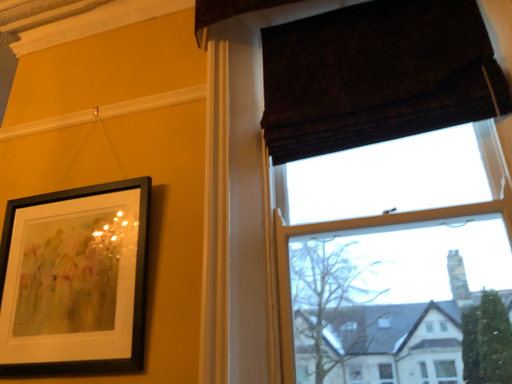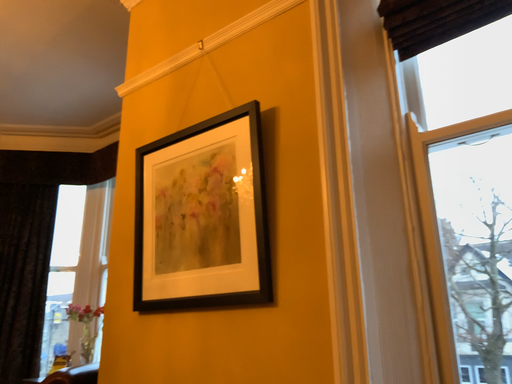
Question: How did the camera likely rotate when shooting the video?

Choices:
 (A) rotated left
 (B) rotated right

Answer: (A)